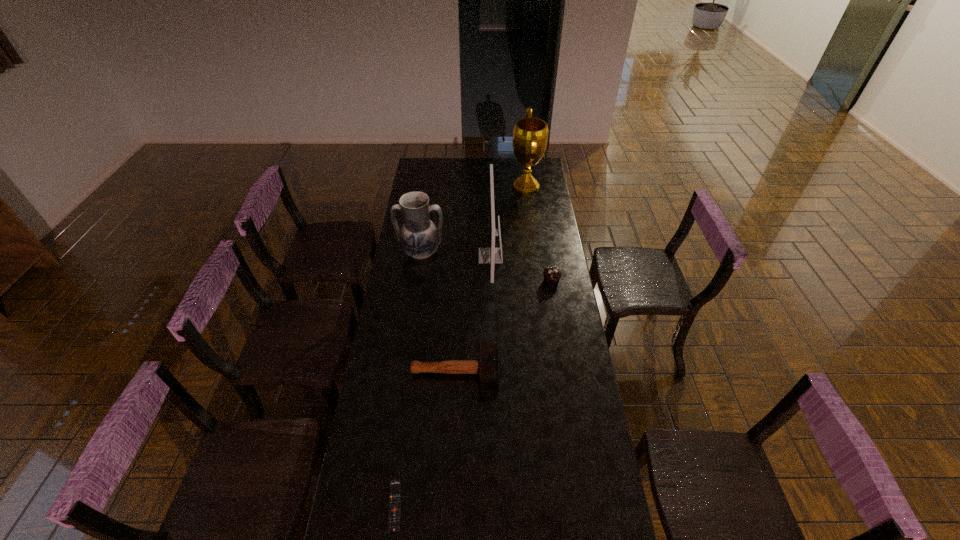
The width and height of the screenshot is (960, 540). I want to click on free space located on the front-facing side of the award, so click(443, 186).

This screenshot has width=960, height=540. In order to click on vacant space located 0.390m on the front-facing side of the monitor in this screenshot , I will do `click(400, 255)`.

Identify the location of vacant space located 0.120m on the front-facing side of the monitor. The width and height of the screenshot is (960, 540). (454, 255).

The image size is (960, 540). In order to click on free spot located 0.190m on the front-facing side of the monitor in this screenshot , I will do `click(441, 255)`.

Find the location of a particular element. vacant space located on the front-facing side of the pitcher is located at coordinates (412, 320).

At what (x,y) coordinates should I click in order to perform the action: click on blank space located 0.120m on the left of the cupcake. Please return your answer as a coordinate pair (x, y). Looking at the image, I should click on (516, 280).

Where is `free location located 0.250m on the hammer head face of the second shortest object`? free location located 0.250m on the hammer head face of the second shortest object is located at coordinates (563, 373).

Where is `free space located 0.150m on the back of the remote control`? This screenshot has width=960, height=540. free space located 0.150m on the back of the remote control is located at coordinates (404, 435).

At what (x,y) coordinates should I click in order to perform the action: click on object at the far edge. Please return your answer as a coordinate pair (x, y). The height and width of the screenshot is (540, 960). Looking at the image, I should click on (530, 135).

The image size is (960, 540). What are the coordinates of `pitcher located in the left edge section of the desktop` in the screenshot? It's located at (419, 237).